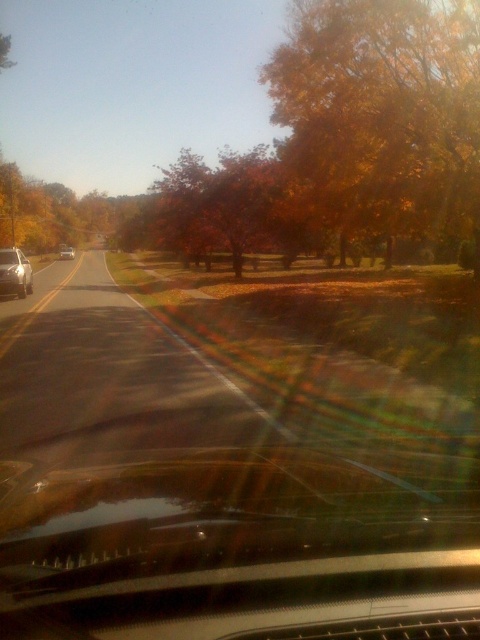
Locate an element on the screen. transparent glass car window at center is located at coordinates (230, 461).

Can you confirm if transparent glass car window at center is thinner than orange leafy tree at center?

Correct, transparent glass car window at center's width is less than orange leafy tree at center's.

Who is more distant from viewer, (264, 516) or (204, 228)?

The point (204, 228) is behind.

Find the location of `transparent glass car window at center`. transparent glass car window at center is located at coordinates (230, 461).

Can you confirm if transparent glass car window at center is bigger than matte black car at left?

Correct, transparent glass car window at center is larger in size than matte black car at left.

What do you see at coordinates (230, 461) in the screenshot? I see `transparent glass car window at center` at bounding box center [230, 461].

Does point (312, 557) lie in front of point (63, 246)?

That is True.

Locate an element on the screen. The image size is (480, 640). transparent glass car window at center is located at coordinates (230, 461).

Between golden leafy tree at upper right and silver metallic sedan at left, which one appears on the right side from the viewer's perspective?

golden leafy tree at upper right is more to the right.

Does golden leafy tree at upper right appear under silver metallic sedan at left?

No, golden leafy tree at upper right is not below silver metallic sedan at left.

Does point (400, 134) lie behind point (10, 291)?

That is False.

You are a GUI agent. You are given a task and a screenshot of the screen. Output one action in this format:
    pyautogui.click(x=<x>, y=<y>)
    Task: Click on the golden leafy tree at upper right
    
    Given the screenshot: What is the action you would take?
    pyautogui.click(x=384, y=113)